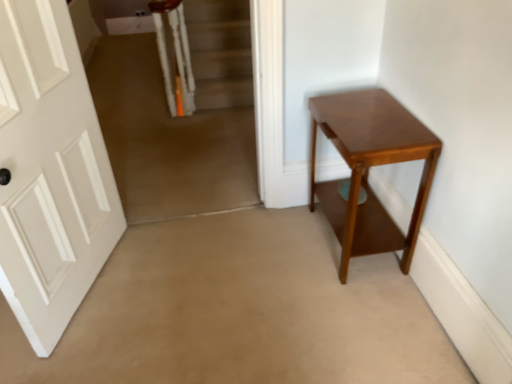
Question: Considering the positions of carpeted stairs at upper left and white matte door at left in the image, is carpeted stairs at upper left bigger or smaller than white matte door at left?

Choices:
 (A) big
 (B) small

Answer: (A)

Question: From the image's perspective, is carpeted stairs at upper left positioned above or below white matte door at left?

Choices:
 (A) below
 (B) above

Answer: (B)

Question: Estimate the real-world distances between objects in this image. Which object is farther from the carpeted stairs at upper left?

Choices:
 (A) shiny brown table at right
 (B) white matte door at left

Answer: (A)

Question: Which of these objects is positioned closest to the carpeted stairs at upper left?

Choices:
 (A) white matte door at left
 (B) shiny brown table at right

Answer: (A)